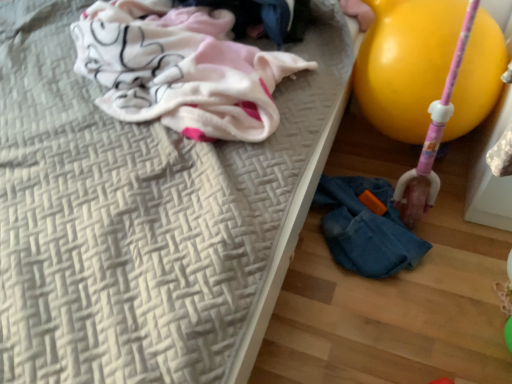
Question: From a real-world perspective, is white woven mattress at upper left above or below white cotton cloth at upper left?

Choices:
 (A) above
 (B) below

Answer: (B)

Question: From their relative heights in the image, would you say white woven mattress at upper left is taller or shorter than white cotton cloth at upper left?

Choices:
 (A) short
 (B) tall

Answer: (B)

Question: Based on their relative distances, which object is farther from the denim jacket at lower right?

Choices:
 (A) yellow rubber balloon at right
 (B) white woven mattress at upper left
 (C) white cotton cloth at upper left

Answer: (C)

Question: Which is nearer to the yellow rubber balloon at right?

Choices:
 (A) denim jacket at lower right
 (B) white woven mattress at upper left
 (C) white cotton cloth at upper left

Answer: (A)